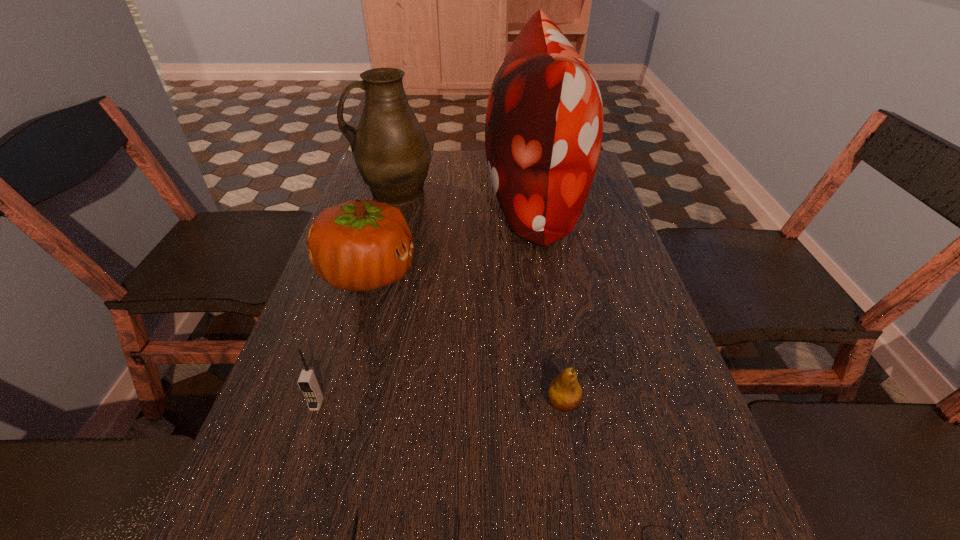
What are the coordinates of `the tallest object` in the screenshot? It's located at (544, 121).

The height and width of the screenshot is (540, 960). What are the coordinates of `pitcher` in the screenshot? It's located at (390, 149).

The height and width of the screenshot is (540, 960). In order to click on the fifth shortest object in this screenshot , I will do `click(359, 245)`.

Where is `cellular telephone`? cellular telephone is located at coordinates (308, 382).

Find the location of `pear`. pear is located at coordinates (565, 394).

Locate an element on the screen. This screenshot has height=540, width=960. vacant point located on the front-facing side of the tallest object is located at coordinates (400, 198).

The width and height of the screenshot is (960, 540). What are the coordinates of `vacant space located 0.050m on the front-facing side of the tallest object` in the screenshot? It's located at (468, 198).

I want to click on vacant position located 0.190m on the front-facing side of the tallest object, so click(420, 198).

In order to click on vacant position located on the side of the pumpkin with the cute face in this screenshot , I will do `click(469, 274)`.

Image resolution: width=960 pixels, height=540 pixels. Find the location of `free space located 0.120m on the front-facing side of the cellular telephone`. free space located 0.120m on the front-facing side of the cellular telephone is located at coordinates (293, 479).